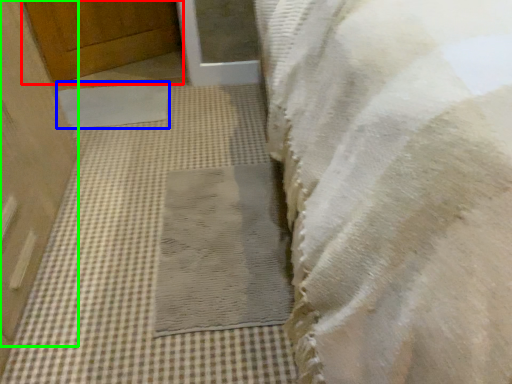
Question: Which is nearer to the door (highlighted by a red box)? mat (highlighted by a blue box) or door (highlighted by a green box).

Choices:
 (A) mat
 (B) door

Answer: (A)